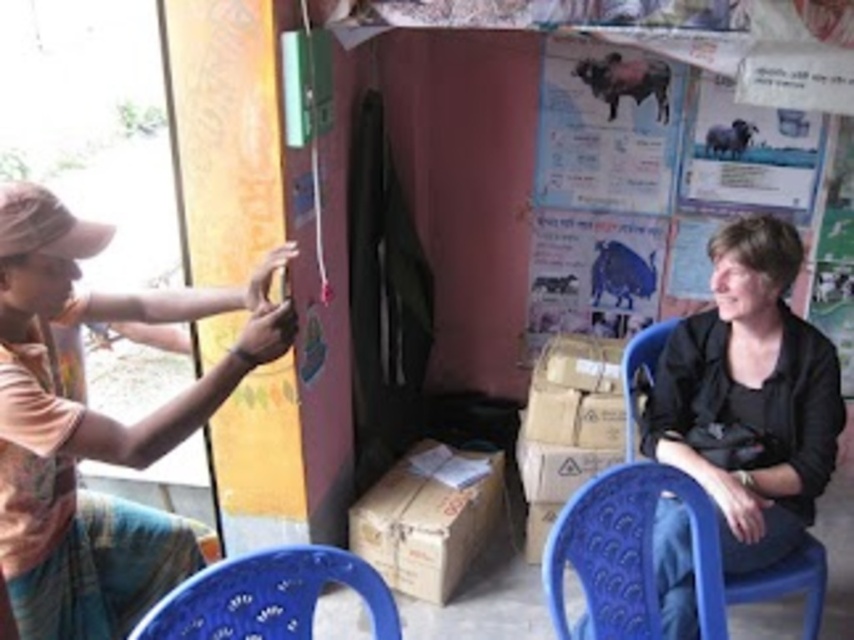
Question: Does black matte jacket at lower right have a smaller size compared to blue plastic chair at lower right?

Choices:
 (A) yes
 (B) no

Answer: (A)

Question: Can you confirm if blue plastic chair at lower right is positioned to the left of blue plastic chair at lower center?

Choices:
 (A) no
 (B) yes

Answer: (A)

Question: Which of these objects is positioned closest to the black matte jacket at lower right?

Choices:
 (A) matte orange shirt at left
 (B) blue plastic chair at lower center
 (C) blue plastic chair at lower right

Answer: (C)

Question: Among these points, which one is farthest from the camera?

Choices:
 (A) (91, 456)
 (B) (686, 515)
 (C) (680, 401)
 (D) (284, 612)

Answer: (C)

Question: Among these points, which one is farthest from the camera?

Choices:
 (A) (367, 596)
 (B) (776, 248)
 (C) (702, 616)

Answer: (B)

Question: Is matte orange shirt at left thinner than blue plastic chair at lower center?

Choices:
 (A) yes
 (B) no

Answer: (B)